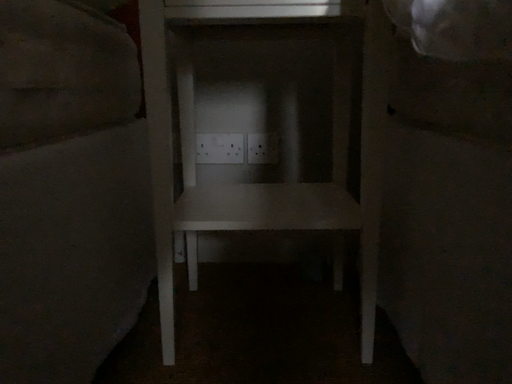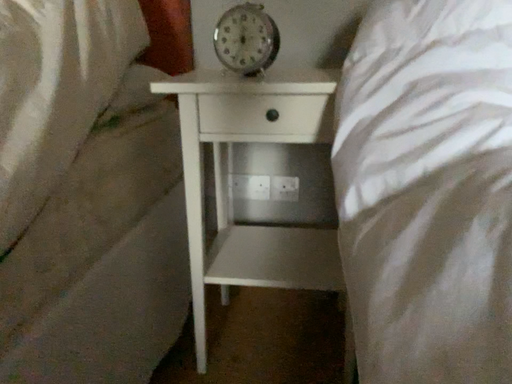
Question: Which way did the camera rotate in the video?

Choices:
 (A) rotated downward
 (B) rotated upward

Answer: (A)